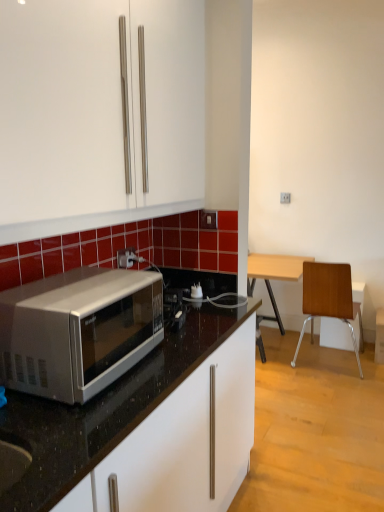
Locate an element on the screen. free space above silver metallic microwave at left (from a real-world perspective) is located at coordinates (73, 284).